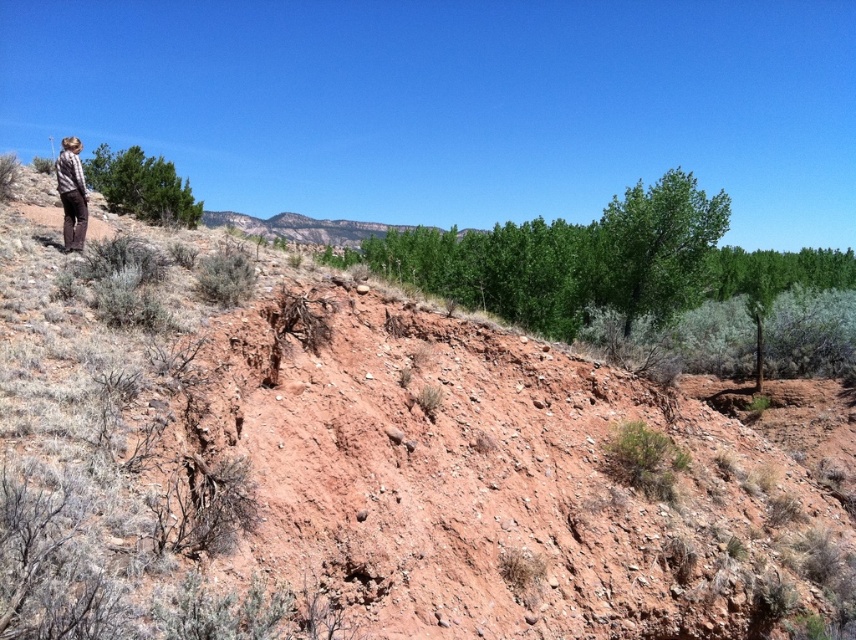
You are a hiker trying to navigate through this arid landscape. You see a green leafy tree at upper left and a plaid shirt at left. Which object is taller?

The green leafy tree at upper left is much taller than the plaid shirt at left, so the green leafy tree at upper left is taller.

You are a hiker trying to navigate through the arid landscape. You see a green leafy tree at upper left and a plaid shirt at left. Which object would provide better shade from the sun?

The green leafy tree at upper left is bigger than the plaid shirt at left, so it would provide better shade from the sun.